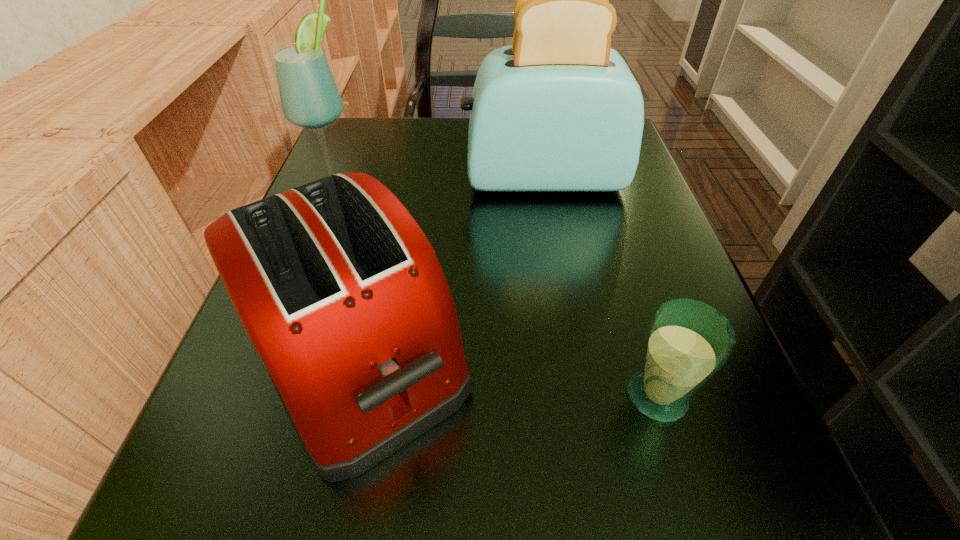
Find the location of `free space located on the left of the glass`. free space located on the left of the glass is located at coordinates (283, 396).

Where is `toaster located at the far edge`? toaster located at the far edge is located at coordinates (558, 110).

This screenshot has height=540, width=960. I want to click on alcohol that is positioned at the far edge, so click(309, 97).

The width and height of the screenshot is (960, 540). Identify the location of object at the near edge. (339, 290).

Where is `alcohol at the left edge`? The width and height of the screenshot is (960, 540). alcohol at the left edge is located at coordinates point(309,97).

Where is `toaster located in the left edge section of the desktop`? This screenshot has width=960, height=540. toaster located in the left edge section of the desktop is located at coordinates (339, 290).

Locate an element on the screen. toaster at the right edge is located at coordinates (558, 110).

Find the location of a particular element. The height and width of the screenshot is (540, 960). glass located at the right edge is located at coordinates (688, 341).

The height and width of the screenshot is (540, 960). What are the coordinates of `object positioned at the far left corner` in the screenshot? It's located at (309, 97).

This screenshot has height=540, width=960. What are the coordinates of `object that is at the near left corner` in the screenshot? It's located at tap(339, 290).